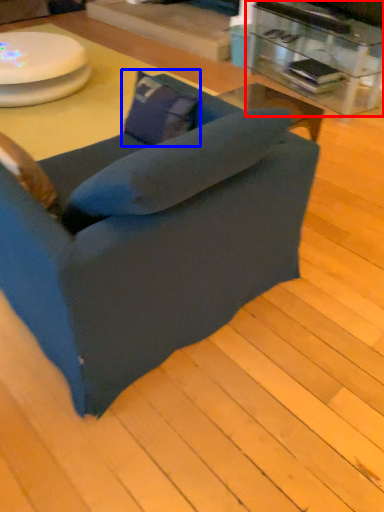
Question: Among these objects, which one is farthest to the camera, table (highlighted by a red box) or pillow (highlighted by a blue box)?

Choices:
 (A) table
 (B) pillow

Answer: (A)